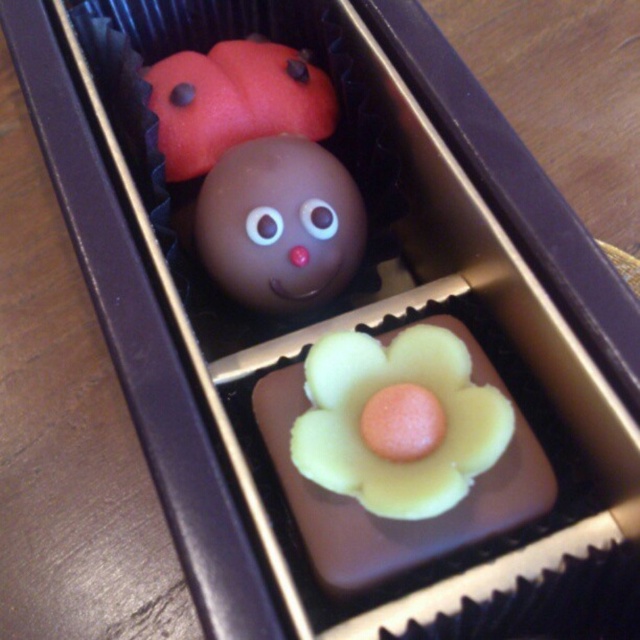
Question: Is yellow matte flower at center further to the viewer compared to matte chocolate ball at center?

Choices:
 (A) no
 (B) yes

Answer: (A)

Question: From the image, what is the correct spatial relationship of matte chocolate ball at center in relation to matte chocolate ladybug at upper left?

Choices:
 (A) right
 (B) left

Answer: (A)

Question: Which object appears farthest from the camera in this image?

Choices:
 (A) yellow matte flower at center
 (B) matte chocolate ball at center
 (C) matte chocolate ladybug at upper left

Answer: (C)

Question: Estimate the real-world distances between objects in this image. Which object is farther from the yellow matte flower at center?

Choices:
 (A) matte chocolate ladybug at upper left
 (B) matte chocolate ball at center

Answer: (A)

Question: Considering the relative positions of matte chocolate ball at center and matte chocolate ladybug at upper left in the image provided, where is matte chocolate ball at center located with respect to matte chocolate ladybug at upper left?

Choices:
 (A) below
 (B) above

Answer: (A)

Question: Which object is closer to the camera taking this photo?

Choices:
 (A) yellow matte flower at center
 (B) matte chocolate ladybug at upper left
 (C) matte chocolate ball at center

Answer: (A)